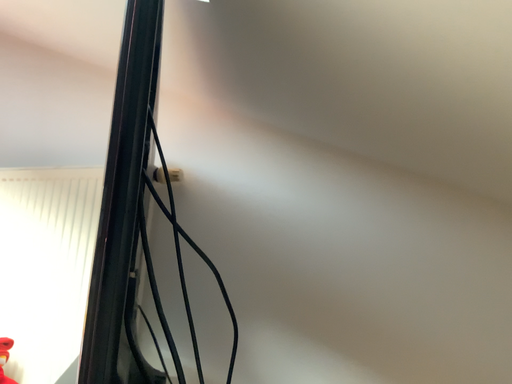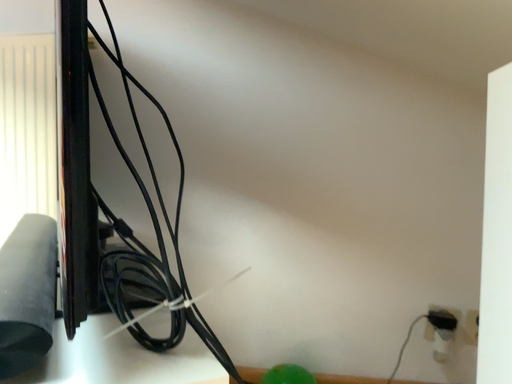
Question: Which way did the camera rotate in the video?

Choices:
 (A) rotated downward
 (B) rotated upward

Answer: (A)